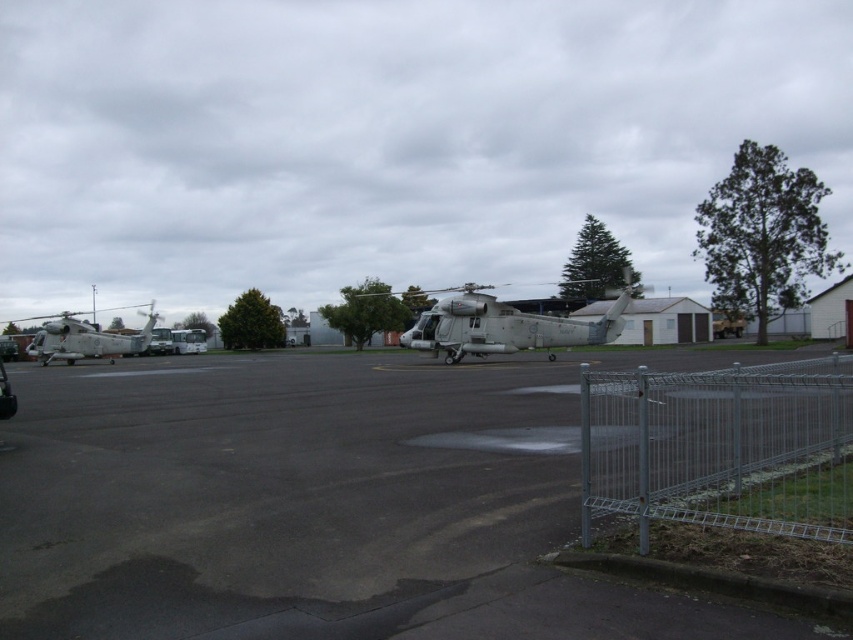
You are standing at the camera position and want to reach the point marked at coordinates (619, 305). The fence in front of you is 100 feet long. Can you walk around the fence to reach that point without crossing it?

The point marked at coordinates (619, 305) is 101.57 feet away from the camera. Since the fence is only 100 feet long, you would need to walk around it, but the distance required to go around would exceed the length of the fence, making it impossible to reach the point without crossing the fence.

You are a maintenance worker needing to park a new helicopter that is 10 meters wide. The new helicopter is wider than both existing ones. Which spot between the gray metallic helicopter at center and the metallic gray helicopter at left would allow the new helicopter to fit without overlapping either?

The metallic gray helicopter at left has a larger width than the gray metallic helicopter at center. Since the new helicopter is wider than both, it would need to be placed in a spot where there is enough space. However, based on the given information, neither existing helicopter provides sufficient width for the new helicopter. Therefore, the new helicopter cannot fit in either spot between them.